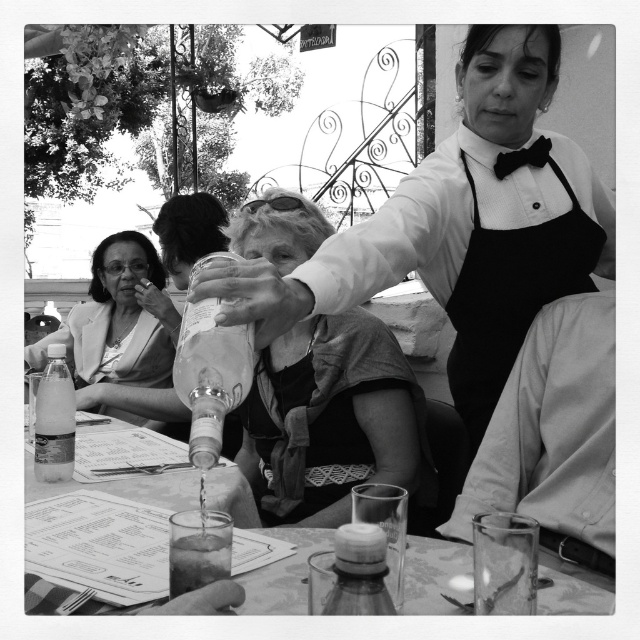
You are a customer at the outdoor cafe. You notice the black fabric apron at upper right and the translucent plastic bottle at lower left. Which object is taller?

The black fabric apron at upper right is taller than the translucent plastic bottle at lower left.

You are standing at the location of the viewer in the image. There is a point marked at coordinates point (x=289, y=557). Can you reach this point without moving your feet?

The point (x=289, y=557) is 5.28 feet away from the viewer. Since the average person can reach about 2 feet in front of them without moving their feet, the point is too far to reach without moving.

You are a customer sitting at the table in the outdoor restaurant. You notice two points marked in the scene. The first point is at coordinates point (525, 317) and the second is at point (42, 444). Which point is closer to your current position?

Point (42, 444) is closer to your current position because it is in front of point (525, 317).